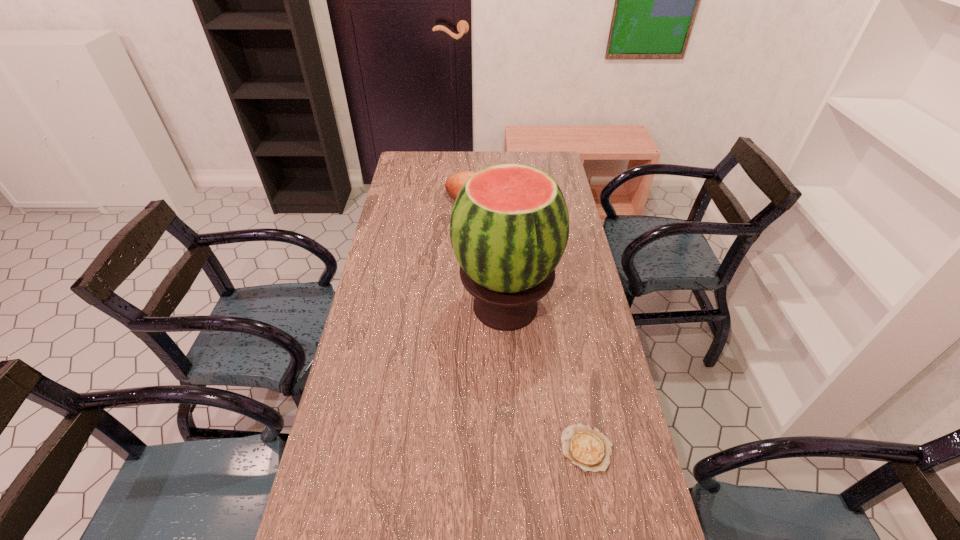
This screenshot has width=960, height=540. In order to click on the tallest object in this screenshot , I will do `click(509, 226)`.

Image resolution: width=960 pixels, height=540 pixels. In order to click on watermelon in this screenshot , I will do `click(509, 226)`.

You are a GUI agent. You are given a task and a screenshot of the screen. Output one action in this format:
    pyautogui.click(x=<x>, y=<y>)
    Task: Click on the second tallest object
    This screenshot has height=540, width=960.
    Given the screenshot: What is the action you would take?
    pyautogui.click(x=454, y=183)

At what (x,y) coordinates should I click in order to perform the action: click on bread. Please return your answer as a coordinate pair (x, y). The height and width of the screenshot is (540, 960). Looking at the image, I should click on 454,183.

Where is `the shortest object`? The image size is (960, 540). the shortest object is located at coordinates (587, 447).

What are the coordinates of `the nearest object` in the screenshot? It's located at (587, 447).

Image resolution: width=960 pixels, height=540 pixels. In order to click on free space located on the front of the watermelon in this screenshot , I will do [x=514, y=475].

Where is `free location located on the back of the bread`? free location located on the back of the bread is located at coordinates (479, 177).

Find the location of a particular element. free space located 0.210m on the left of the shortest object is located at coordinates (478, 448).

Where is `watermelon positioned at the right edge`? The height and width of the screenshot is (540, 960). watermelon positioned at the right edge is located at coordinates (509, 226).